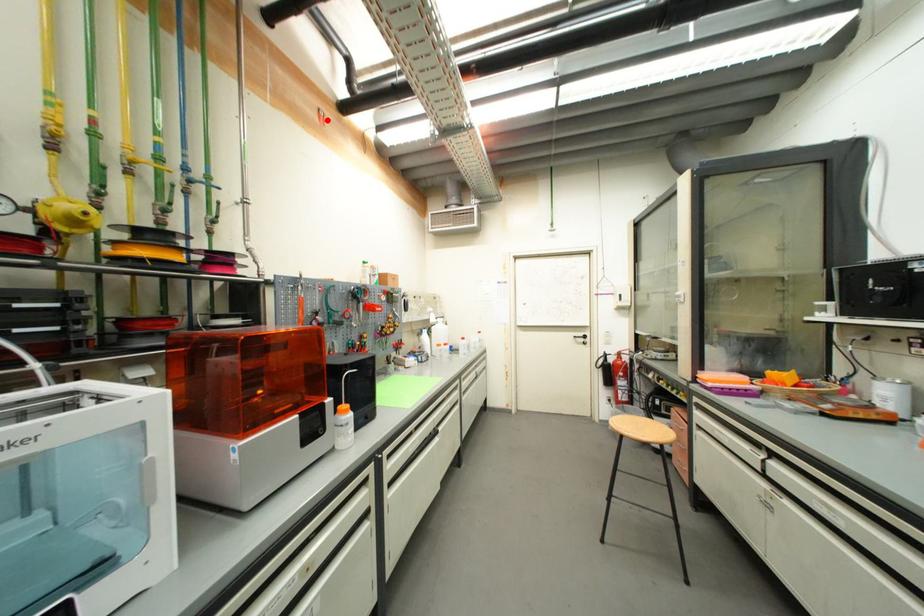
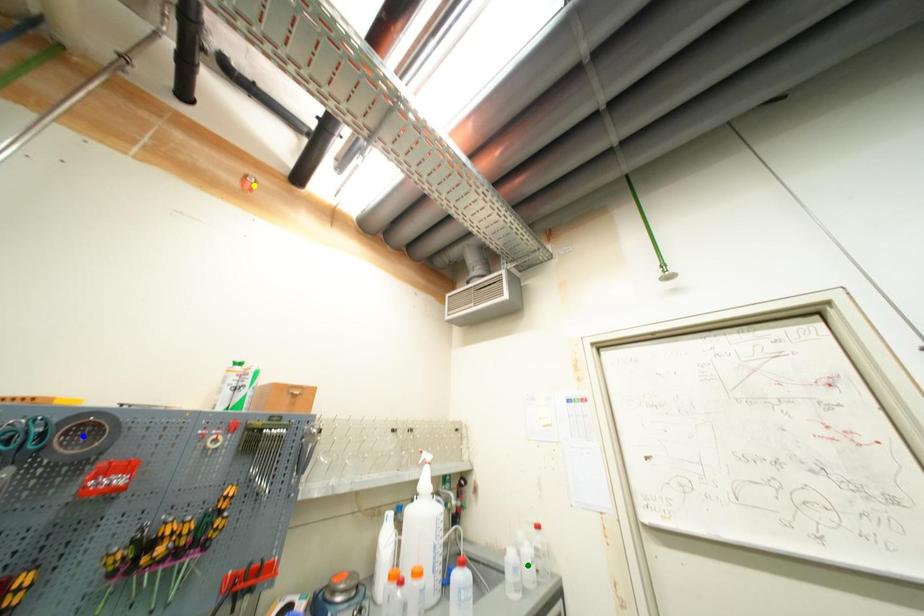
Question: I am providing you with two images of the same scene from different viewpoints. A red point is marked on the first image. You are given multiple points on the second image. In image 2, which mark is for the same physical point as the one in image 1?

Choices:
 (A) yellow point
 (B) green point
 (C) blue point

Answer: (A)